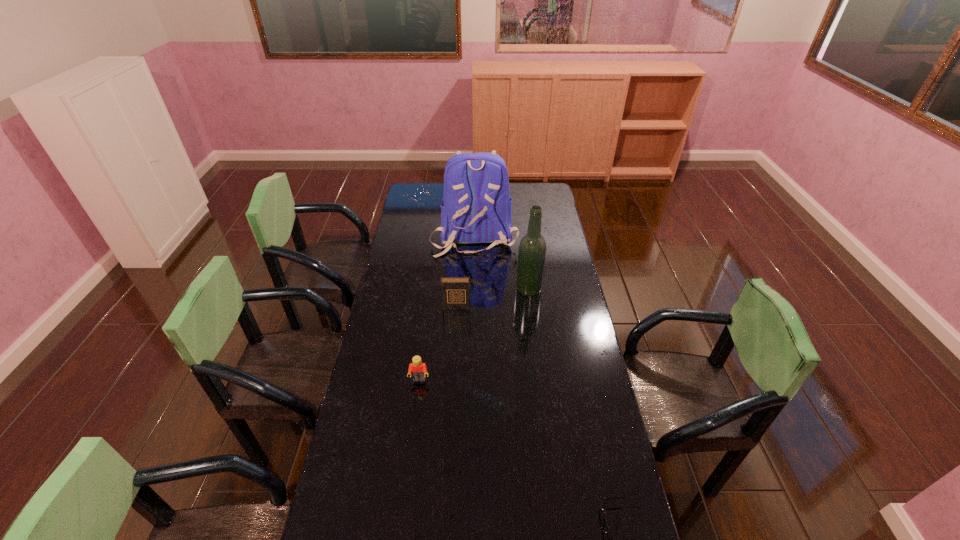
At what (x,y) coordinates should I click in order to perform the action: click on object located in the right edge section of the desktop. Please return your answer as a coordinate pair (x, y). Looking at the image, I should click on (532, 248).

Locate an element on the screen. The width and height of the screenshot is (960, 540). free space at the left edge of the desktop is located at coordinates (333, 506).

Where is `vacant space at the right edge of the desktop`? vacant space at the right edge of the desktop is located at coordinates (578, 389).

At what (x,y) coordinates should I click in order to perform the action: click on free space at the far right corner of the desktop. Please return your answer as a coordinate pair (x, y). Image resolution: width=960 pixels, height=540 pixels. Looking at the image, I should click on (532, 186).

Locate an element on the screen. The height and width of the screenshot is (540, 960). free spot between the fourth nearest object and the second shortest object is located at coordinates (474, 334).

The image size is (960, 540). I want to click on free space that is in between the diary and the fourth nearest object, so click(492, 298).

The height and width of the screenshot is (540, 960). Find the location of `empty space that is in between the third farthest object and the backpack`. empty space that is in between the third farthest object and the backpack is located at coordinates (466, 271).

Identify the location of object identified as the second closest to the nearest object. The height and width of the screenshot is (540, 960). [532, 248].

Locate which object ranks second in proximity to the third tallest object. Please provide its 2D coordinates. Your answer should be formatted as a tuple, i.e. [(x, y)], where the tuple contains the x and y coordinates of a point satisfying the conditions above.

[(477, 208)]

At what (x,y) coordinates should I click in order to perform the action: click on free point that satisfies the following two spatial constraints: 1. on the back of the farthest object; 2. on the left side of the fourth nearest object. Please return your answer as a coordinate pair (x, y). Looking at the image, I should click on (473, 289).